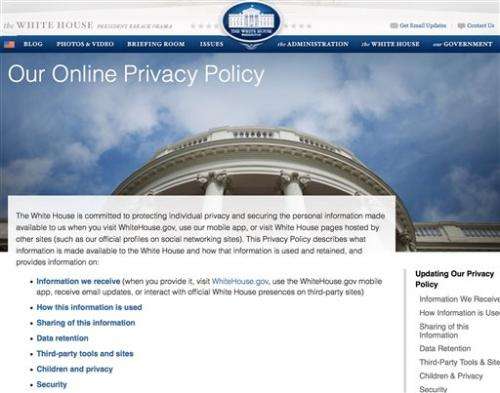
Where is `columns`? columns is located at coordinates (210, 182), (293, 186).